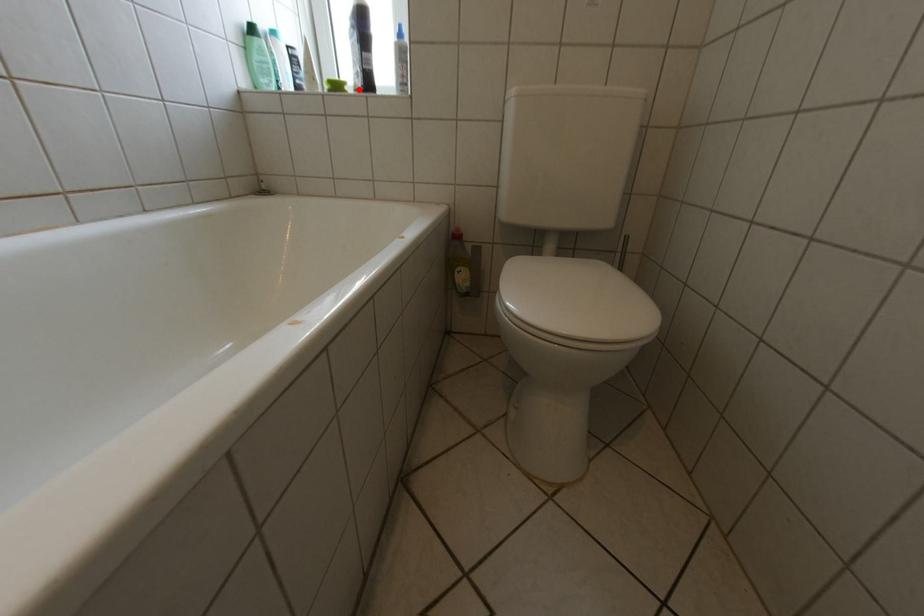
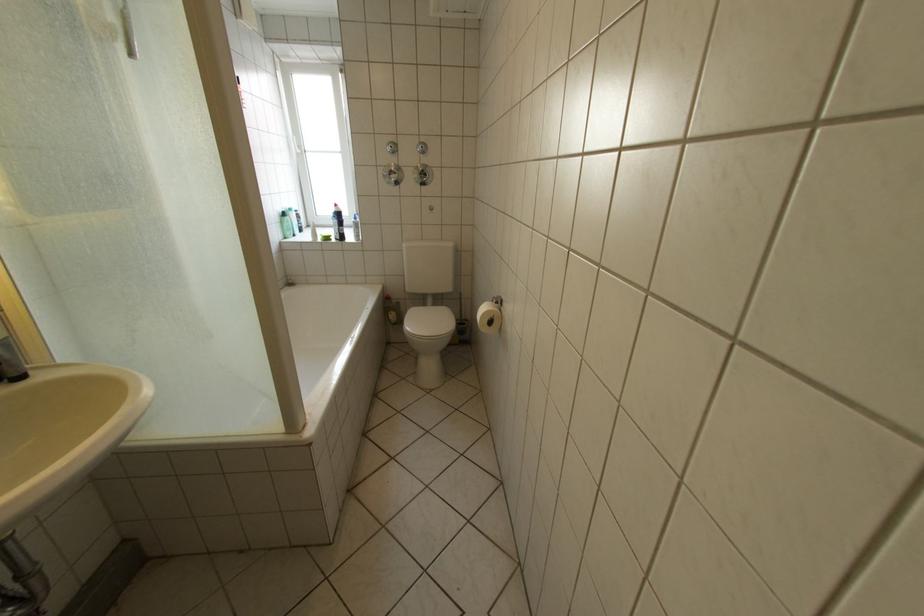
The point at the highlighted location is marked in the first image. Where is the corresponding point in the second image?

(344, 238)